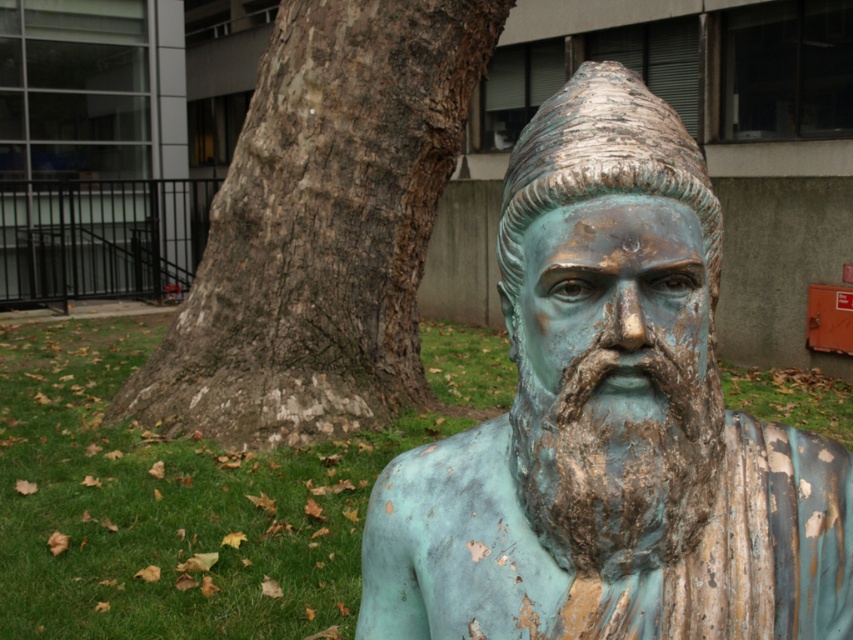
You are a gardener planning to mow the green grass at lower left. Will the brown textured bark at center interfere with your mowing path?

The brown textured bark at center is above the green grass at lower left, so it will not interfere with the mowing path since it is elevated.

You are standing in a park and see a bronze statue of a bearded man with a traditional headdress. There is a point at coordinates (611, 422). Based on the scene description, where would this point most likely be located?

The point at coordinates (611, 422) is on the green patina bronze bust at center.

You are standing in the park and want to touch the brown textured bark at center. Based on the coordinates provided, in which direction should you move to reach it?

The brown textured bark at center is located at coordinates point (322, 227), so you should move towards the center of the scene to reach it.